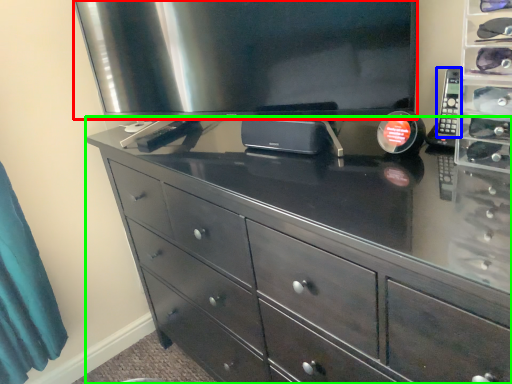
Question: Considering the real-world distances, which object is closest to television (highlighted by a red box)? control (highlighted by a blue box) or chest of drawers (highlighted by a green box).

Choices:
 (A) control
 (B) chest of drawers

Answer: (B)